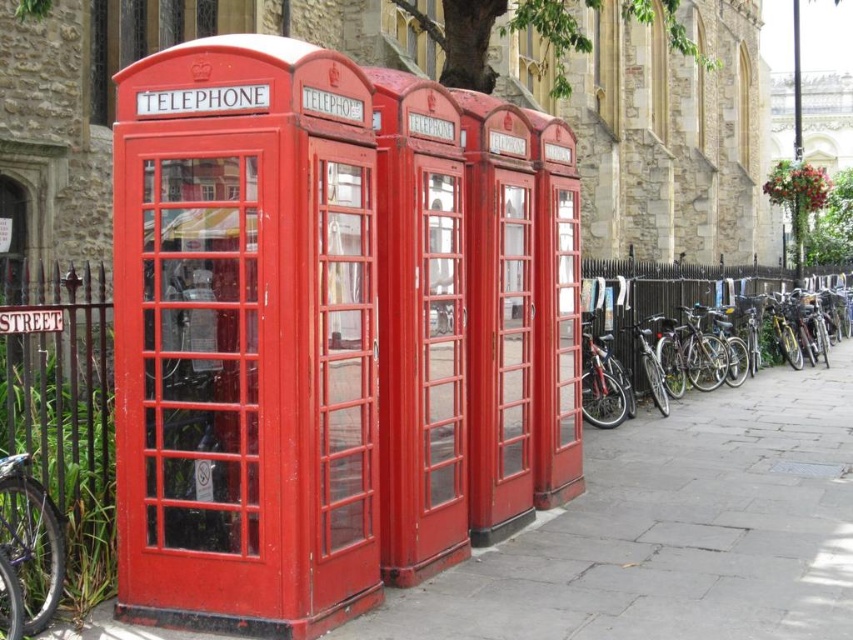
Question: Does shiny metallic bicycle at right have a greater width compared to metallic purple bicycle at lower left?

Choices:
 (A) no
 (B) yes

Answer: (B)

Question: Among these points, which one is farthest from the camera?

Choices:
 (A) (148, 346)
 (B) (612, 298)
 (C) (566, 560)
 (D) (3, 472)

Answer: (B)

Question: Based on their relative distances, which object is farther from the metallic purple bicycle at lower left?

Choices:
 (A) shiny metallic bicycle at right
 (B) matte glass telephone booth at left

Answer: (A)

Question: Is matte glass telephone booth at left below smooth concrete pavement at lower center?

Choices:
 (A) no
 (B) yes

Answer: (A)

Question: Does smooth concrete pavement at lower center have a greater width compared to metallic purple bicycle at lower left?

Choices:
 (A) no
 (B) yes

Answer: (B)

Question: Among these points, which one is nearest to the camera?

Choices:
 (A) (703, 554)
 (B) (202, 451)

Answer: (B)